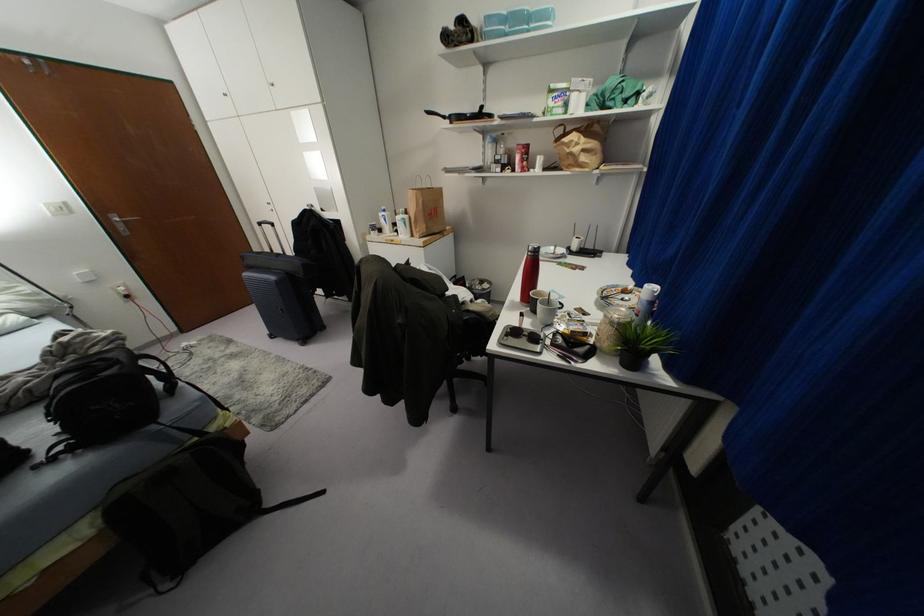
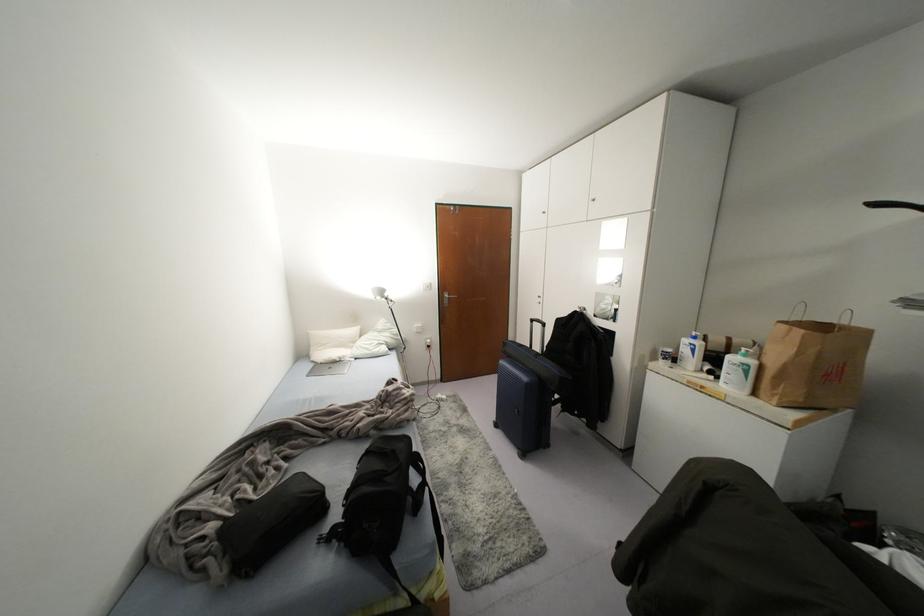
Where in the second image is the point corresponding to (272,224) from the first image?

(542, 323)